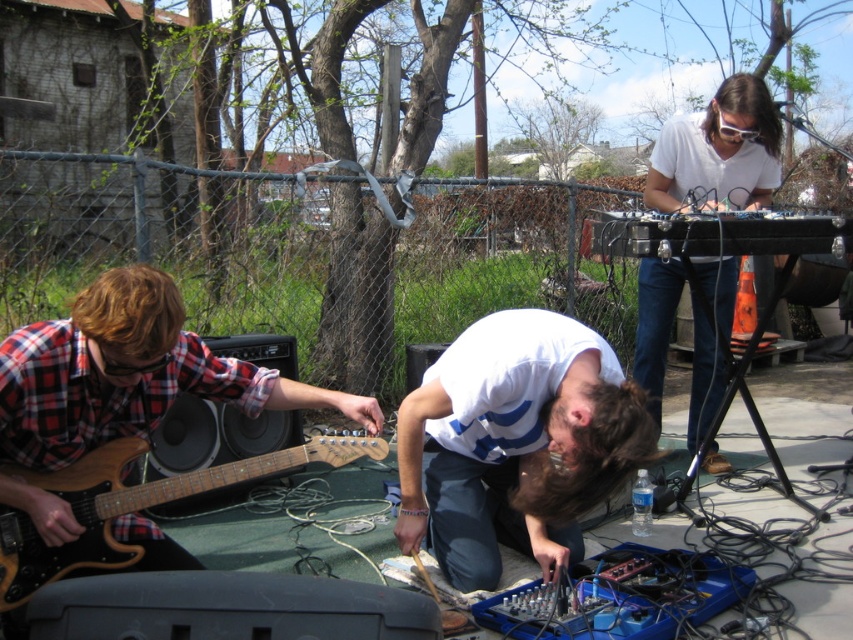
Question: Can you confirm if white matte keyboard at upper right is positioned to the left of wooden electric guitar at lower left?

Choices:
 (A) no
 (B) yes

Answer: (A)

Question: Estimate the real-world distances between objects in this image. Which object is closer to the white matte shirt at center?

Choices:
 (A) white matte keyboard at upper right
 (B) wooden electric guitar at lower left

Answer: (B)

Question: Which point is closer to the camera?

Choices:
 (A) (131, 500)
 (B) (473, 339)

Answer: (A)

Question: In this image, where is white matte keyboard at upper right located relative to wooden electric guitar at lower left?

Choices:
 (A) above
 (B) below

Answer: (A)

Question: Does white matte shirt at center appear on the left side of wooden electric guitar at lower left?

Choices:
 (A) yes
 (B) no

Answer: (B)

Question: Which object is closer to the camera taking this photo?

Choices:
 (A) white matte keyboard at upper right
 (B) white matte shirt at center

Answer: (B)